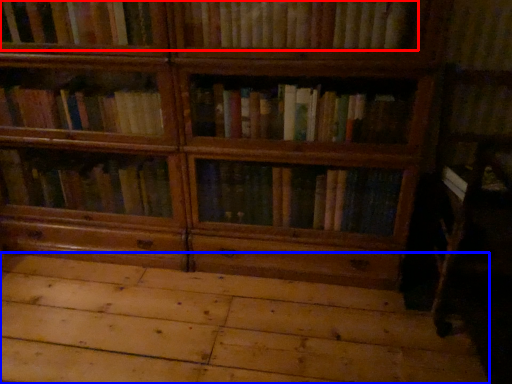
Question: Which object is closer to the camera taking this photo, book (highlighted by a red box) or plywood (highlighted by a blue box)?

Choices:
 (A) book
 (B) plywood

Answer: (B)